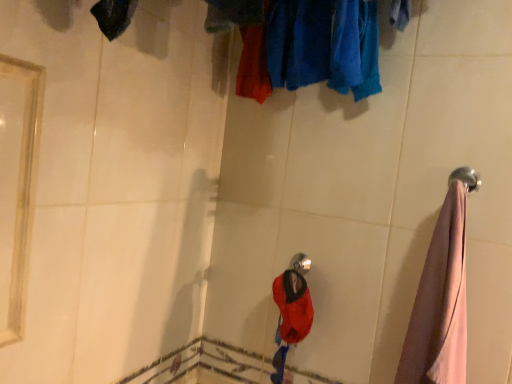
Describe the element at coordinates (300, 263) in the screenshot. I see `shiny metallic shower head at center` at that location.

Find the location of a particular element. The height and width of the screenshot is (384, 512). velvet-like red hat at center is located at coordinates (292, 307).

You are a GUI agent. You are given a task and a screenshot of the screen. Output one action in this format:
    pyautogui.click(x=<x>, y=<y>)
    Task: Click on the polished silver towel rack at right
    
    Given the screenshot: What is the action you would take?
    pyautogui.click(x=466, y=178)

Image resolution: width=512 pixels, height=384 pixels. Find the location of `shiny metallic shower head at center`. shiny metallic shower head at center is located at coordinates (300, 263).

From a real-world perspective, is shiny metallic shower head at center physically located above or below pink fabric towel at right?

In terms of real-world spatial position, shiny metallic shower head at center is below pink fabric towel at right.

Locate an element on the screen. This screenshot has width=512, height=384. shower that appears behind the pink fabric towel at right is located at coordinates (300, 263).

Between shiny metallic shower head at center and pink fabric towel at right, which one has more height?

pink fabric towel at right.

Based on the photo, how distant is pink fabric towel at right from velvet-like red hat at center?

They are 13.37 inches apart.

Locate an element on the screen. garment located on the right of velvet-like red hat at center is located at coordinates (440, 303).

Between pink fabric towel at right and velvet-like red hat at center, which one has smaller size?

With smaller size is velvet-like red hat at center.

Based on the photo, considering the sizes of objects velvet-like red hat at center and shiny metallic shower head at center in the image provided, who is taller, velvet-like red hat at center or shiny metallic shower head at center?

velvet-like red hat at center is taller.

Where is `clothing that is under the shiny metallic shower head at center (from a real-world perspective)`? This screenshot has height=384, width=512. clothing that is under the shiny metallic shower head at center (from a real-world perspective) is located at coordinates (292, 307).

Who is more distant, velvet-like red hat at center or shiny metallic shower head at center?

shiny metallic shower head at center is behind.

Identify the location of clothing below the polished silver towel rack at right (from the image's perspective). This screenshot has height=384, width=512. (292, 307).

From a real-world perspective, is polished silver towel rack at right positioned above or below velvet-like red hat at center?

polished silver towel rack at right is situated higher than velvet-like red hat at center in the real world.

Considering the sizes of objects polished silver towel rack at right and velvet-like red hat at center in the image provided, who is shorter, polished silver towel rack at right or velvet-like red hat at center?

polished silver towel rack at right is shorter.

Which point is more distant from viewer, (x=434, y=305) or (x=292, y=260)?

The point (x=292, y=260) is farther.

From their relative heights in the image, would you say pink fabric towel at right is taller or shorter than shiny metallic shower head at center?

Clearly, pink fabric towel at right is taller compared to shiny metallic shower head at center.

Can you tell me how much pink fabric towel at right and shiny metallic shower head at center differ in facing direction?

The angular difference between pink fabric towel at right and shiny metallic shower head at center is 0.546 degrees.

This screenshot has height=384, width=512. In order to click on shower lying above the pink fabric towel at right (from the image's perspective) in this screenshot , I will do `click(300, 263)`.

From the picture: Do you think velvet-like red hat at center is within polished silver towel rack at right, or outside of it?

velvet-like red hat at center exists outside the volume of polished silver towel rack at right.

Which object is positioned more to the left, velvet-like red hat at center or polished silver towel rack at right?

velvet-like red hat at center is more to the left.

What's the angular difference between velvet-like red hat at center and polished silver towel rack at right's facing directions?

0.000581 degrees.

Who is smaller, velvet-like red hat at center or polished silver towel rack at right?

Smaller between the two is polished silver towel rack at right.

The width and height of the screenshot is (512, 384). What are the coordinates of `towel rack located on the right of pink fabric towel at right` in the screenshot? It's located at (466, 178).

Does point (465, 339) appear closer or farther from the camera than point (471, 174)?

Point (465, 339) is positioned closer to the camera compared to point (471, 174).

Can you confirm if pink fabric towel at right is positioned to the left of polished silver towel rack at right?

Correct, you'll find pink fabric towel at right to the left of polished silver towel rack at right.

Can polished silver towel rack at right be found inside pink fabric towel at right?

Yes, pink fabric towel at right is surrounding polished silver towel rack at right.

Where is `shower lying on the left of pink fabric towel at right`? This screenshot has height=384, width=512. shower lying on the left of pink fabric towel at right is located at coordinates (300, 263).

The height and width of the screenshot is (384, 512). In the image, there is a velvet-like red hat at center. What are the coordinates of `garment above it (from the image's perspective)` in the screenshot? It's located at (440, 303).

Which object lies nearer to the anchor point shiny metallic shower head at center, pink fabric towel at right or polished silver towel rack at right?

Among the two, pink fabric towel at right is located nearer to shiny metallic shower head at center.

Estimate the real-world distances between objects in this image. Which object is further from pink fabric towel at right, shiny metallic shower head at center or velvet-like red hat at center?

shiny metallic shower head at center lies further to pink fabric towel at right than the other object.

Looking at the image, which one is located closer to shiny metallic shower head at center, pink fabric towel at right or velvet-like red hat at center?

velvet-like red hat at center is positioned closer to the anchor shiny metallic shower head at center.

Based on their spatial positions, is shiny metallic shower head at center or pink fabric towel at right further from velvet-like red hat at center?

pink fabric towel at right is further to velvet-like red hat at center.

Considering their positions, is polished silver towel rack at right positioned further to pink fabric towel at right than shiny metallic shower head at center?

shiny metallic shower head at center is further to pink fabric towel at right.

Considering their positions, is velvet-like red hat at center positioned closer to shiny metallic shower head at center than pink fabric towel at right?

The object closer to shiny metallic shower head at center is velvet-like red hat at center.

Looking at the image, which one is located further to velvet-like red hat at center, pink fabric towel at right or shiny metallic shower head at center?

The object further to velvet-like red hat at center is pink fabric towel at right.

Estimate the real-world distances between objects in this image. Which object is further from velvet-like red hat at center, polished silver towel rack at right or shiny metallic shower head at center?

polished silver towel rack at right.

Locate an element on the screen. The image size is (512, 384). garment between velvet-like red hat at center and polished silver towel rack at right in the horizontal direction is located at coordinates (440, 303).

The width and height of the screenshot is (512, 384). Identify the location of garment located between shiny metallic shower head at center and polished silver towel rack at right in the left-right direction. (440, 303).

Where is `shower situated between velvet-like red hat at center and polished silver towel rack at right from left to right`? The width and height of the screenshot is (512, 384). shower situated between velvet-like red hat at center and polished silver towel rack at right from left to right is located at coordinates (300, 263).

I want to click on shower between velvet-like red hat at center and pink fabric towel at right in the horizontal direction, so click(300, 263).